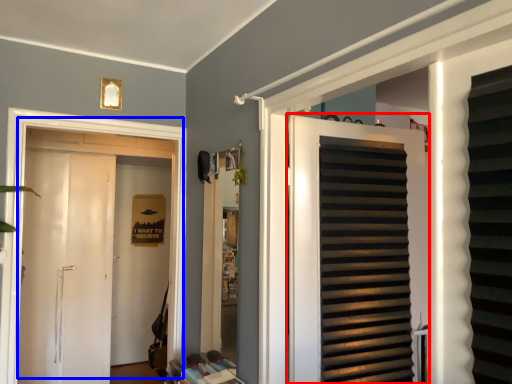
Question: Which of the following is the farthest to the observer, door (highlighted by a red box) or door (highlighted by a blue box)?

Choices:
 (A) door
 (B) door

Answer: (B)